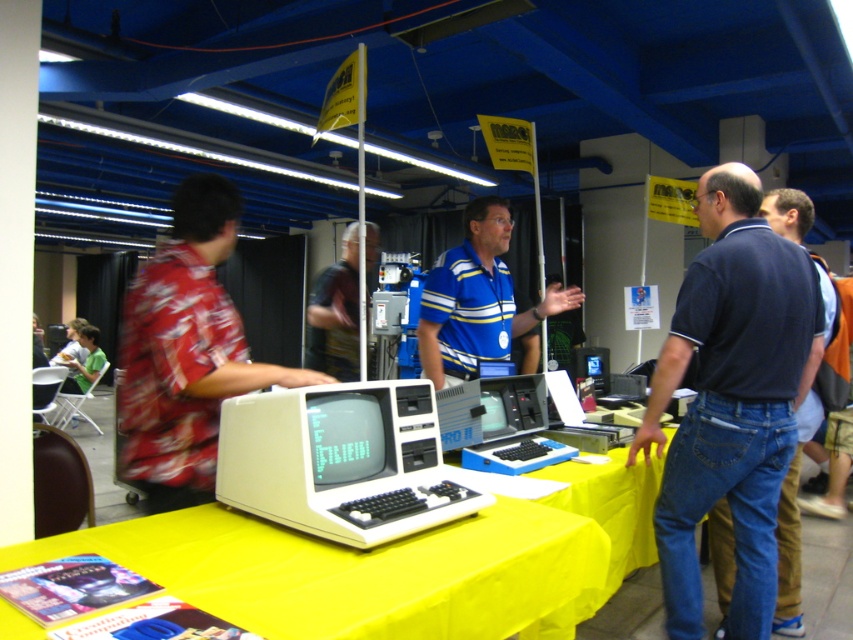
Question: Estimate the real-world distances between objects in this image. Which object is farther from the floral fabric shirt at center?

Choices:
 (A) white plastic computer at center
 (B) floral shirt at left
 (C) yellow fabric table at center

Answer: (A)

Question: Does yellow fabric table at center have a larger size compared to white plastic computer at center?

Choices:
 (A) yes
 (B) no

Answer: (A)

Question: Which point is closer to the camera taking this photo?

Choices:
 (A) (509, 378)
 (B) (194, 365)
 (C) (450, 273)
 (D) (589, 397)

Answer: (B)

Question: Does blue plastic laptop at center appear under matte black laptop at center?

Choices:
 (A) no
 (B) yes

Answer: (B)

Question: Can you confirm if dark blue cotton shirt at right is thinner than yellow fabric table at center?

Choices:
 (A) yes
 (B) no

Answer: (A)

Question: Which of these objects is positioned farthest from the blue plastic laptop at center?

Choices:
 (A) floral shirt at left
 (B) blue striped shirt at center
 (C) yellow fabric table at center

Answer: (A)